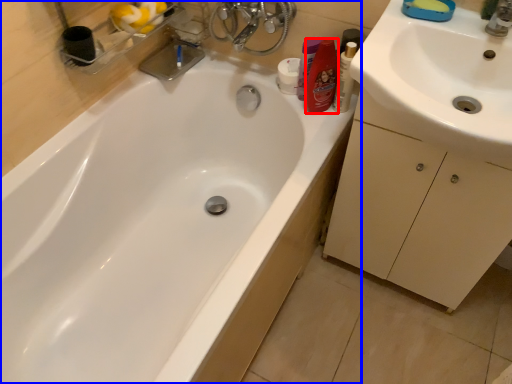
Question: Which of the following is the farthest to the observer, toiletry (highlighted by a red box) or bathtub (highlighted by a blue box)?

Choices:
 (A) toiletry
 (B) bathtub

Answer: (A)